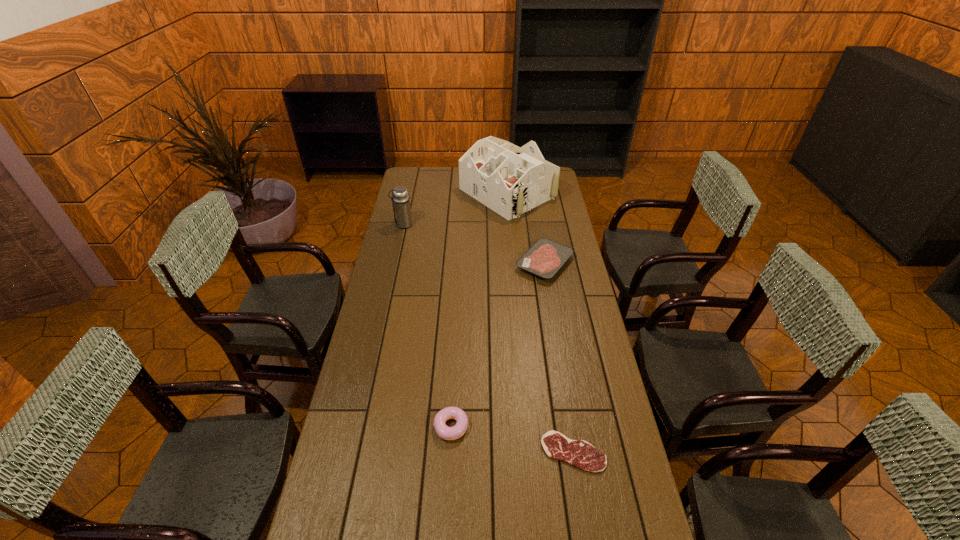
Select which object appears as the fourth closest to the farther steak. Please provide its 2D coordinates. Your answer should be formatted as a tuple, i.e. [(x, y)], where the tuple contains the x and y coordinates of a point satisfying the conditions above.

[(579, 453)]

Find the location of a particular element. The image size is (960, 540). vacant space that satisfies the following two spatial constraints: 1. with a handle on the side of the nearer steak; 2. on the right side of the leftmost object is located at coordinates (352, 452).

Locate an element on the screen. This screenshot has width=960, height=540. free region that satisfies the following two spatial constraints: 1. with a handle on the side of the fourth shortest object; 2. on the back side of the shortest object is located at coordinates (352, 452).

Image resolution: width=960 pixels, height=540 pixels. What are the coordinates of `vacant space that satisfies the following two spatial constraints: 1. on the back side of the doughnut; 2. on the right side of the farther steak` in the screenshot? It's located at (460, 263).

At what (x,y) coordinates should I click in order to perform the action: click on vacant space that satisfies the following two spatial constraints: 1. with a handle on the side of the fourth tallest object; 2. on the right side of the second tallest object. Please return your answer as a coordinate pair (x, y). This screenshot has height=540, width=960. Looking at the image, I should click on (395, 263).

What are the coordinates of `free space that satisfies the following two spatial constraints: 1. with a handle on the side of the farther steak; 2. on the right side of the thermos bottle` in the screenshot? It's located at (395, 263).

Where is `free space that satisfies the following two spatial constraints: 1. with a handle on the side of the doughnut; 2. on the left side of the leftmost object`? The width and height of the screenshot is (960, 540). free space that satisfies the following two spatial constraints: 1. with a handle on the side of the doughnut; 2. on the left side of the leftmost object is located at coordinates pos(358,427).